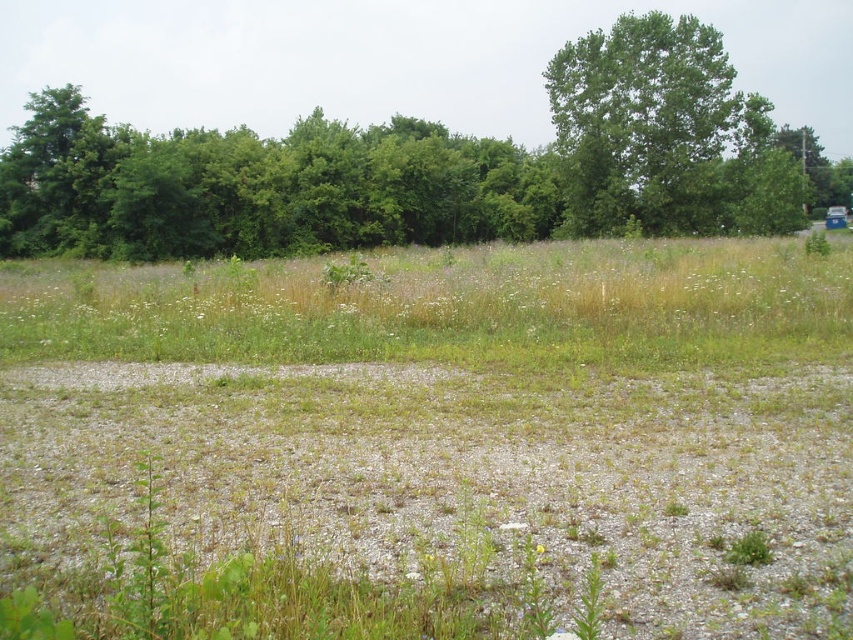
You are a gardener planning to plant a row of sunflowers in the center of the landscape. The sunflowers require a planting area that is at least 10 inches wide. Given the gray gravel at center and the green grass at center, which area would you choose for planting the sunflowers and why?

The green grass at center is wider than the gray gravel at center, so you should choose the green grass at center for planting the sunflowers since it meets the required width of 10 inches.

You are standing at the edge of the open landscape and want to place a small garden tool exactly where the gray gravel at center is located. According to the image, what are the coordinates of the spot where you should place the tool?

The coordinates for the gray gravel at center are at point (x=463, y=477).

You are a hiker who needs to cross from the gray gravel at center to the green grass at center. The path between them is 19.32 meters. If your backpack weighs 15 kilograms, will the distance affect your ability to make the crossing?

The distance between the gray gravel at center and the green grass at center is 19.32 meters. Since the backpack weighs 15 kilograms, the hiker can still cross the 19.32 meters distance as the weight does not directly impact the ability to traverse the distance unless the hiker has physical limitations not mentioned here.